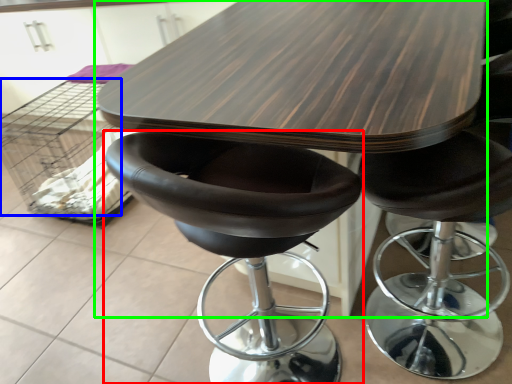
Question: Considering the real-world distances, which object is closest to chair (highlighted by a red box)? crate (highlighted by a blue box) or table (highlighted by a green box).

Choices:
 (A) crate
 (B) table

Answer: (B)